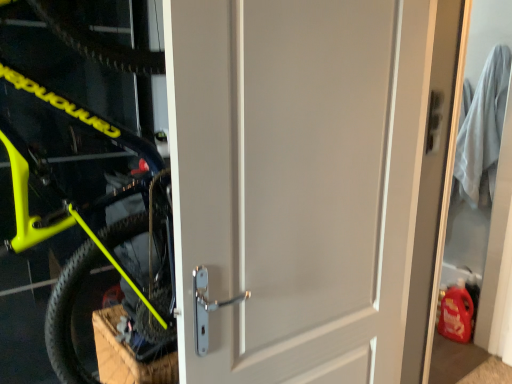
Where is `neon yellow matte bicycle at left`? The width and height of the screenshot is (512, 384). neon yellow matte bicycle at left is located at coordinates (87, 225).

What do you see at coordinates (467, 236) in the screenshot? I see `white matte door at right` at bounding box center [467, 236].

Where is `white matte door at center`? white matte door at center is located at coordinates (312, 182).

Image resolution: width=512 pixels, height=384 pixels. What do you see at coordinates (312, 182) in the screenshot?
I see `white matte door at center` at bounding box center [312, 182].

At what (x,y) coordinates should I click in order to perform the action: click on neon yellow matte bicycle at left. Please return your answer as a coordinate pair (x, y). The image size is (512, 384). Looking at the image, I should click on (87, 225).

Which object is positioned more to the right, white matte door at right or neon yellow matte bicycle at left?

From the viewer's perspective, white matte door at right appears more on the right side.

Considering the sizes of objects white matte door at right and neon yellow matte bicycle at left in the image provided, who is shorter, white matte door at right or neon yellow matte bicycle at left?

neon yellow matte bicycle at left.

Considering the positions of points (455, 374) and (11, 68), is point (455, 374) farther from camera compared to point (11, 68)?

Yes.

From a real-world perspective, is white matte door at right positioned above or below neon yellow matte bicycle at left?

Clearly, from a real-world perspective, white matte door at right is below neon yellow matte bicycle at left.

From the image's perspective, is white matte door at right located above or below white matte door at center?

From the image's perspective, white matte door at right appears above white matte door at center.

Is white matte door at right wider or thinner than white matte door at center?

In the image, white matte door at right appears to be more narrow than white matte door at center.

Is white matte door at right facing away from white matte door at center?

No, white matte door at right's orientation is not away from white matte door at center.

This screenshot has width=512, height=384. I want to click on door lying below the white matte door at right (from the image's perspective), so click(x=312, y=182).

Considering the sizes of objects white matte door at center and neon yellow matte bicycle at left in the image provided, who is shorter, white matte door at center or neon yellow matte bicycle at left?

white matte door at center.

Between white matte door at center and neon yellow matte bicycle at left, which one appears on the right side from the viewer's perspective?

Positioned to the right is white matte door at center.

Is white matte door at center wider than neon yellow matte bicycle at left?

No.

From the image's perspective, between neon yellow matte bicycle at left and white matte door at right, which one is located above?

neon yellow matte bicycle at left, from the image's perspective.

From a real-world perspective, between neon yellow matte bicycle at left and white matte door at right, who is vertically lower?

From a 3D spatial view, white matte door at right is below.

At what (x,y) coordinates should I click in order to perform the action: click on bicycle above the white matte door at right (from the image's perspective). Please return your answer as a coordinate pair (x, y). Image resolution: width=512 pixels, height=384 pixels. Looking at the image, I should click on (87, 225).

Considering the sizes of neon yellow matte bicycle at left and white matte door at right in the image, is neon yellow matte bicycle at left bigger or smaller than white matte door at right?

Considering their sizes, neon yellow matte bicycle at left takes up more space than white matte door at right.

Is point (172, 81) in front of point (457, 204)?

Yes, point (172, 81) is closer to viewer.

Based on the photo, is white matte door at center spatially inside white matte door at right, or outside of it?

white matte door at center cannot be found inside white matte door at right.

Is white matte door at center facing towards white matte door at right?

No, white matte door at center is not turned towards white matte door at right.

Is white matte door at center far from white matte door at right?

white matte door at center is far away from white matte door at right.

How many degrees apart are the facing directions of neon yellow matte bicycle at left and white matte door at center?

The angle between the facing direction of neon yellow matte bicycle at left and the facing direction of white matte door at center is 88.8 degrees.

Measure the distance from neon yellow matte bicycle at left to white matte door at center.

neon yellow matte bicycle at left and white matte door at center are 24.74 inches apart.

Based on the photo, is neon yellow matte bicycle at left turned away from white matte door at center?

No, neon yellow matte bicycle at left is not facing away from white matte door at center.

Is the position of neon yellow matte bicycle at left less distant than that of white matte door at center?

Yes, neon yellow matte bicycle at left is closer to the viewer.

This screenshot has width=512, height=384. In the image, there is a white matte door at right. Find the location of `bicycle above it (from the image's perspective)`. bicycle above it (from the image's perspective) is located at coordinates (87, 225).

Identify the location of garage door below the white matte door at center (from a real-world perspective). (467, 236).

Considering their positions, is neon yellow matte bicycle at left positioned closer to white matte door at right than white matte door at center?

white matte door at center is closer to white matte door at right.

When comparing their distances from neon yellow matte bicycle at left, does white matte door at right or white matte door at center seem closer?

The object closer to neon yellow matte bicycle at left is white matte door at center.

Estimate the real-world distances between objects in this image. Which object is closer to white matte door at center, white matte door at right or neon yellow matte bicycle at left?

neon yellow matte bicycle at left.

Based on their spatial positions, is neon yellow matte bicycle at left or white matte door at right closer to white matte door at center?

Among the two, neon yellow matte bicycle at left is located nearer to white matte door at center.

Looking at the image, which one is located closer to neon yellow matte bicycle at left, white matte door at center or white matte door at right?

white matte door at center is closer to neon yellow matte bicycle at left.

Looking at the image, which one is located closer to white matte door at right, white matte door at center or neon yellow matte bicycle at left?

Based on the image, white matte door at center appears to be nearer to white matte door at right.

I want to click on door located between neon yellow matte bicycle at left and white matte door at right in the left-right direction, so click(312, 182).